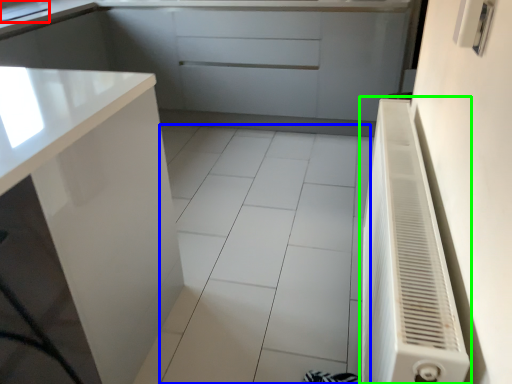
Question: Which is nearer to the sink (highlighted by a red box)? ceramic tile (highlighted by a blue box) or air conditioner (highlighted by a green box).

Choices:
 (A) ceramic tile
 (B) air conditioner

Answer: (A)